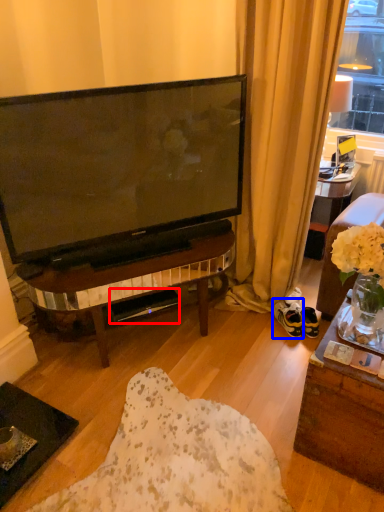
Question: Which object is further to the camera taking this photo, loudspeaker (highlighted by a red box) or footwear (highlighted by a blue box)?

Choices:
 (A) loudspeaker
 (B) footwear

Answer: (B)